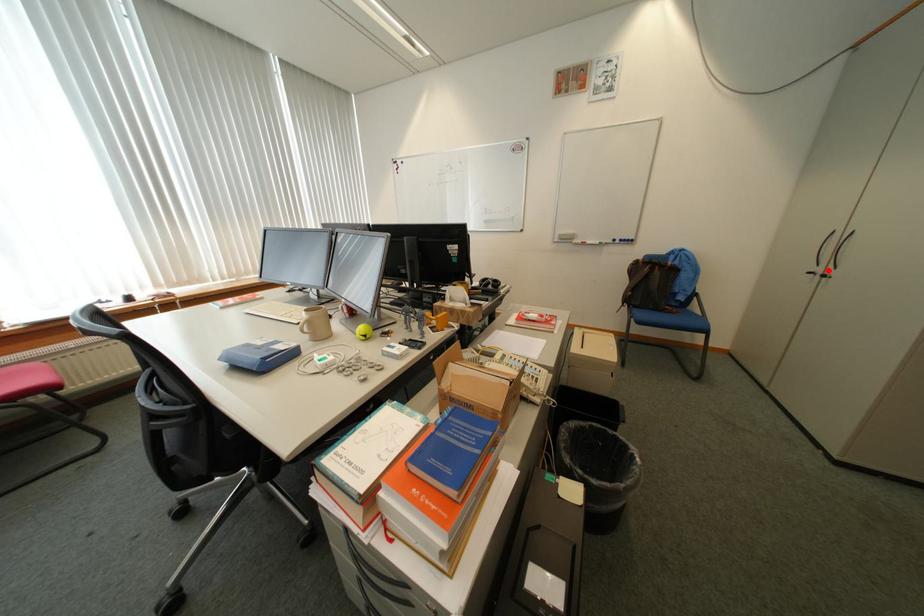
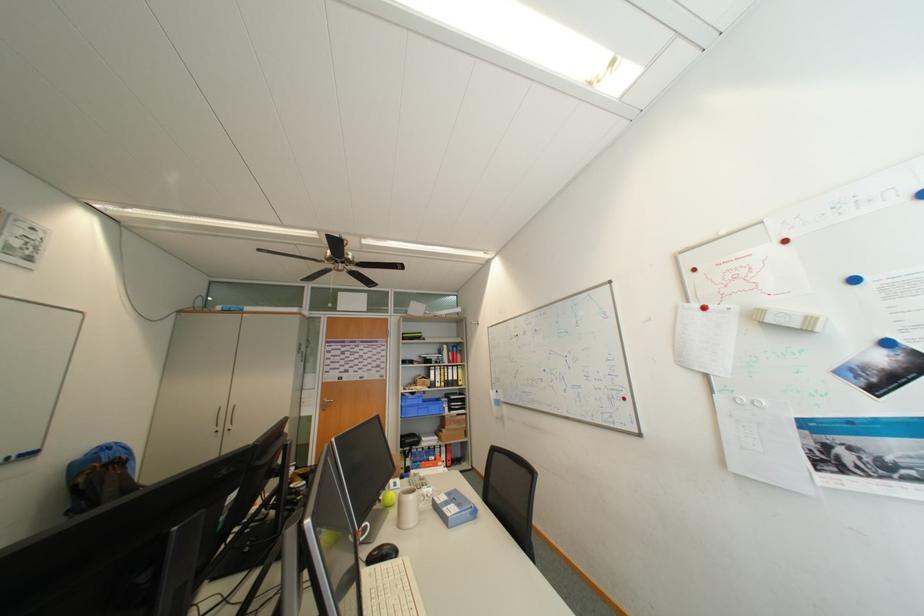
Find the pixel in the second image that matches the highlighted location in the first image.

(229, 429)